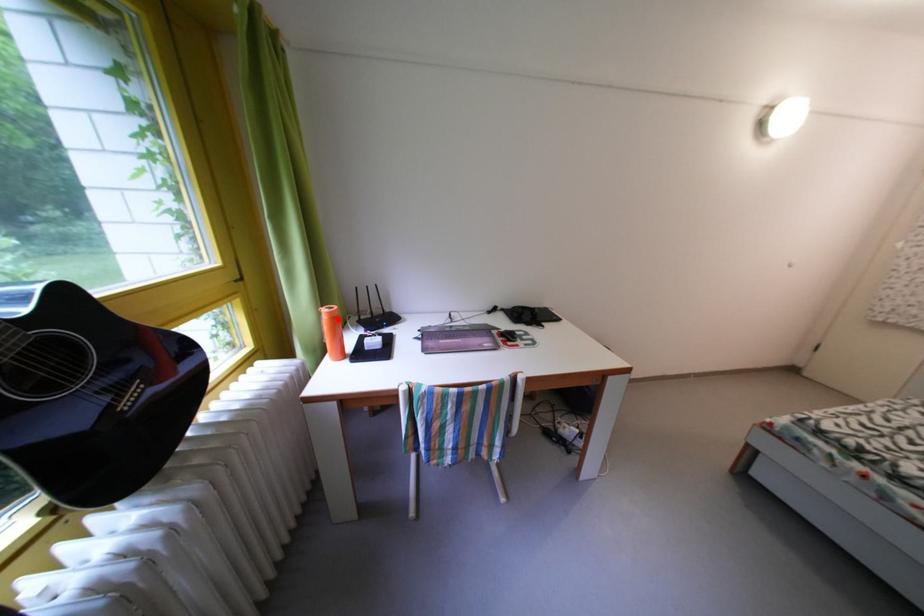
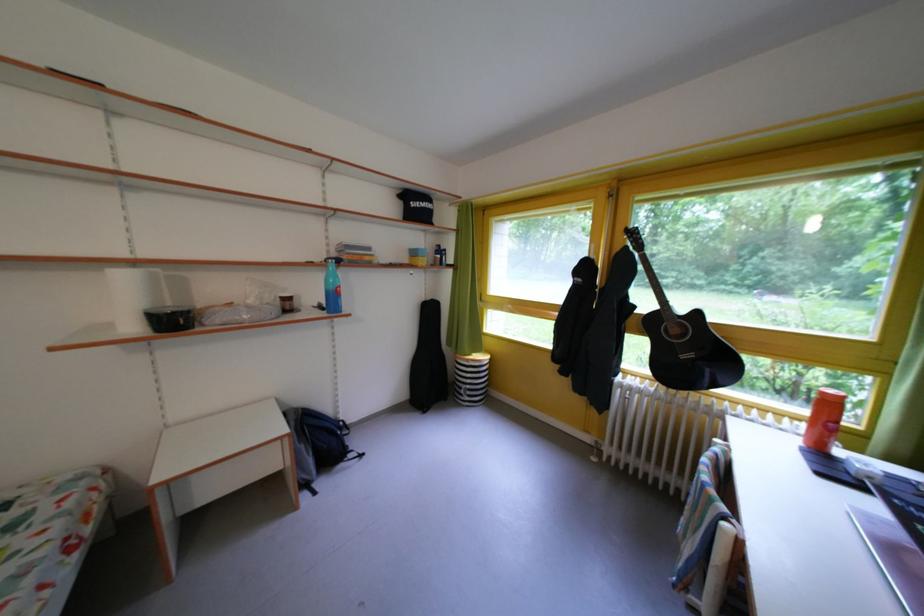
Where in the second image is the point corresponding to the highlighted location from the first image?

(833, 399)